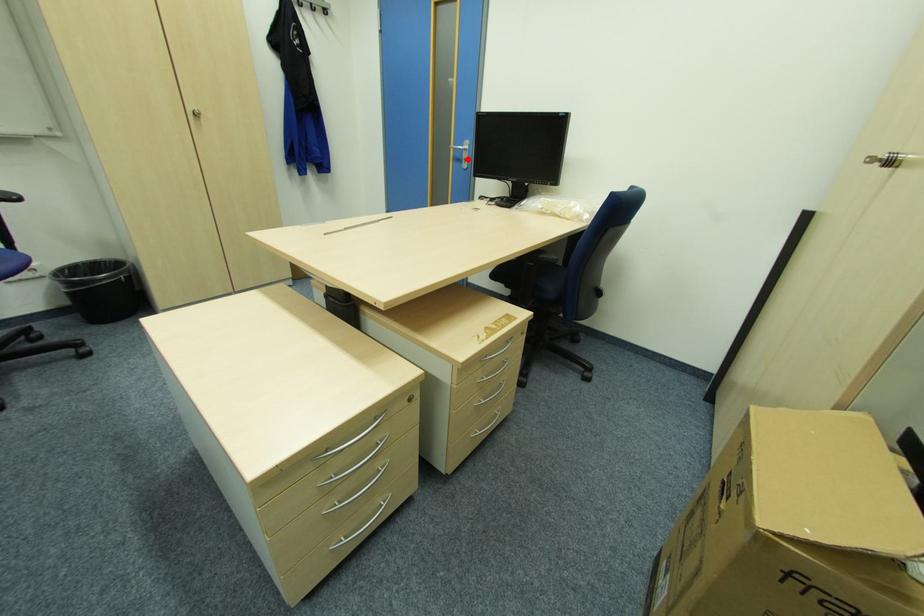
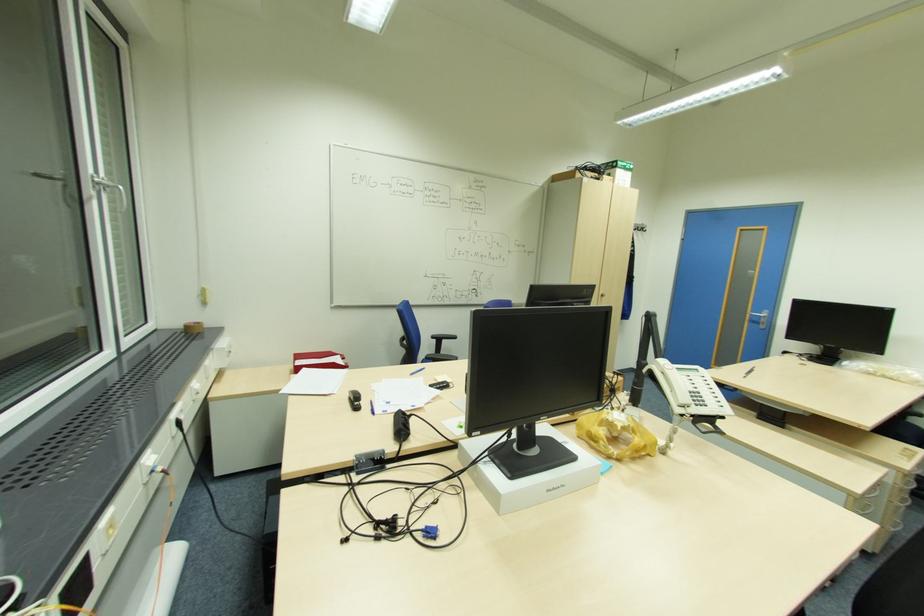
Locate, in the second image, the point that corresponds to the highlighted location in the first image.

(766, 323)